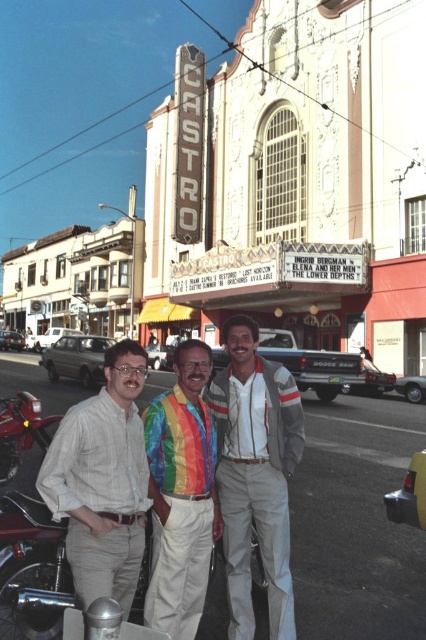
You are a photographer standing in front of the Castro Theatre. You notice the rainbow tie at center and the shiny red motorcycle at lower left. Which object is closer to you, the photographer?

The rainbow tie at center is closer to you because it is in front of the shiny red motorcycle at lower left.

You are a photographer standing in front of the Castro Theatre on a sunny day. You notice a person wearing a light beige shirt at center and a shiny red motorcycle at lower left in your viewfinder. Which object is positioned higher in the frame?

The light beige shirt at center is located above the shiny red motorcycle at lower left, so the light beige shirt at center is positioned higher in the frame.

You are a photographer standing in front of the Castro Theatre on a sunny day. You notice a rainbow fabric shirt at center and a shiny red motorcycle at lower left. Which object is taller in the image?

The rainbow fabric shirt at center has a greater height compared to the shiny red motorcycle at lower left, so the rainbow fabric shirt at center is taller.